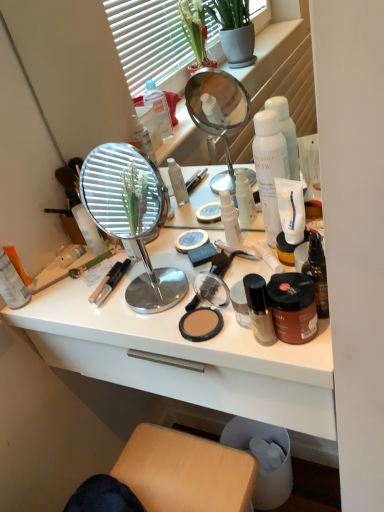
In order to click on vacant space to the right of orange matte lotion at left, positioned as the first toiletry in left-to-right order in this screenshot , I will do `click(92, 288)`.